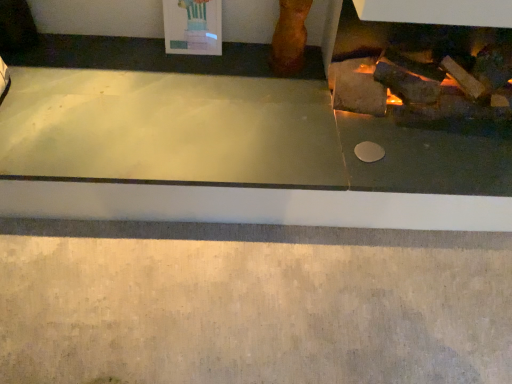
You are a GUI agent. You are given a task and a screenshot of the screen. Output one action in this format:
    pyautogui.click(x=<x>, y=<y>)
    Task: Click on the free point above matte stone fireplace at right (from a real-world perspective)
    The width and height of the screenshot is (512, 384).
    Given the screenshot: What is the action you would take?
    pyautogui.click(x=208, y=106)